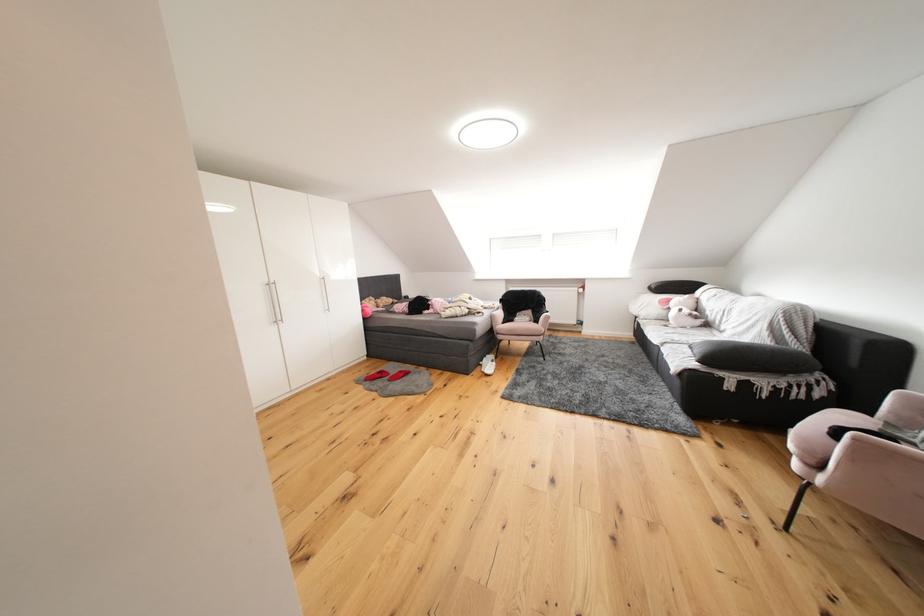
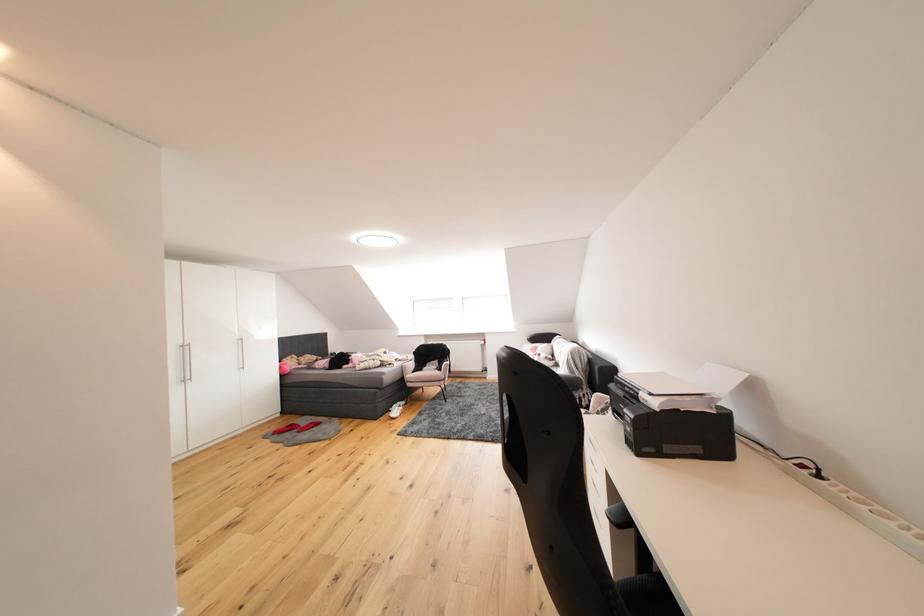
Locate, in the second image, the point that corresponds to pixel 402 371 in the first image.

(313, 424)